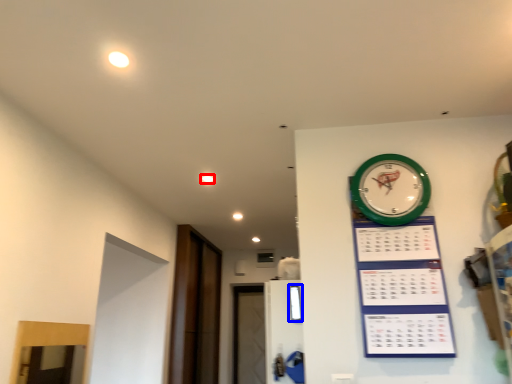
Question: Which point is closer to the camera, light (highlighted by a red box) or window (highlighted by a blue box)?

Choices:
 (A) light
 (B) window

Answer: (B)